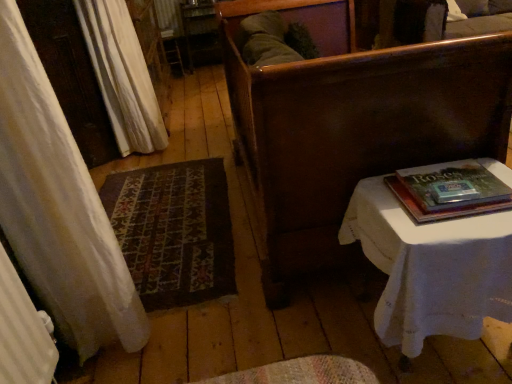
Question: Should I look upward or downward to see hardcover book at right?

Choices:
 (A) up
 (B) down

Answer: (A)

Question: Would you consider hardcover book at right to be distant from dark brown wood bench at center?

Choices:
 (A) yes
 (B) no

Answer: (B)

Question: From a real-world perspective, is hardcover book at right positioned over dark brown wood bench at center based on gravity?

Choices:
 (A) yes
 (B) no

Answer: (A)

Question: Could you tell me if hardcover book at right is facing dark brown wood bench at center?

Choices:
 (A) no
 (B) yes

Answer: (A)

Question: Is hardcover book at right completely or partially outside of dark brown wood bench at center?

Choices:
 (A) yes
 (B) no

Answer: (B)

Question: Does hardcover book at right lie in front of dark brown wood bench at center?

Choices:
 (A) no
 (B) yes

Answer: (A)

Question: From the image's perspective, is hardcover book at right over dark brown wood bench at center?

Choices:
 (A) no
 (B) yes

Answer: (A)

Question: From the image's perspective, would you say dark brown wood bench at center is positioned over hardcover book at right?

Choices:
 (A) yes
 (B) no

Answer: (A)

Question: Is dark brown wood bench at center shorter than hardcover book at right?

Choices:
 (A) yes
 (B) no

Answer: (B)

Question: Is hardcover book at right surrounded by dark brown wood bench at center?

Choices:
 (A) yes
 (B) no

Answer: (A)

Question: Does dark brown wood bench at center lie in front of hardcover book at right?

Choices:
 (A) no
 (B) yes

Answer: (B)

Question: Can you confirm if dark brown wood bench at center is positioned to the right of hardcover book at right?

Choices:
 (A) no
 (B) yes

Answer: (A)

Question: Is dark brown wood bench at center far from hardcover book at right?

Choices:
 (A) no
 (B) yes

Answer: (A)

Question: Does dark brown wood bench at center have a smaller size compared to white cloth-covered table at right?

Choices:
 (A) yes
 (B) no

Answer: (B)